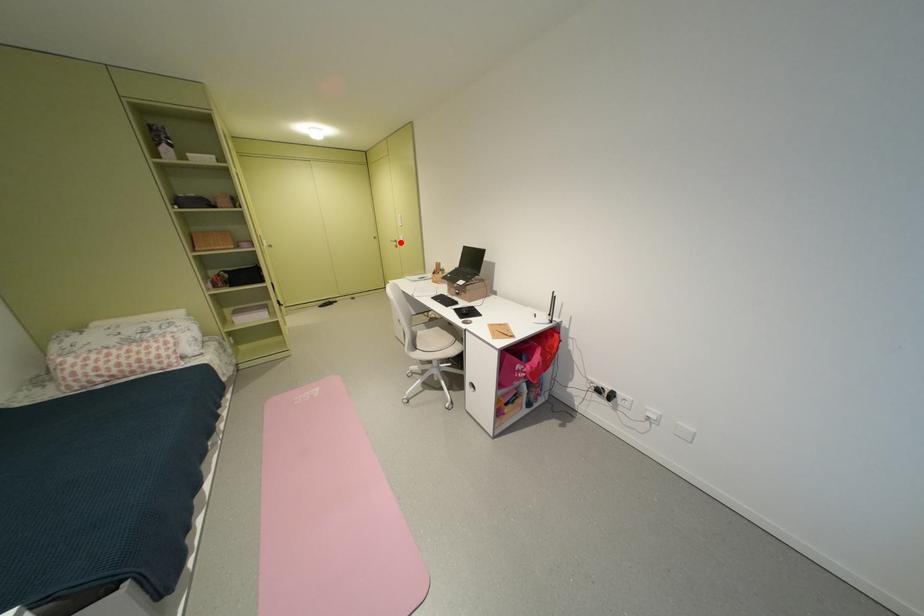
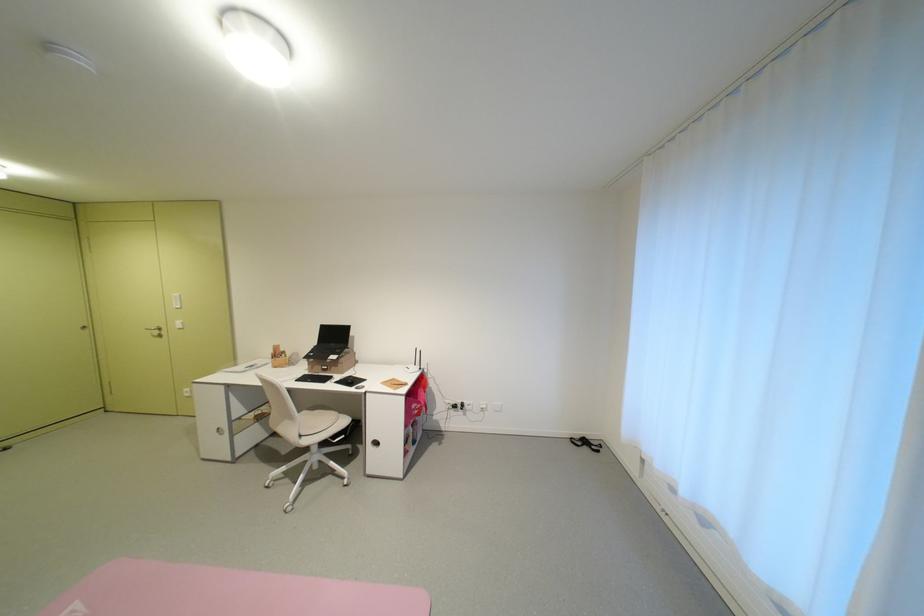
Locate, in the second image, the point that corresponds to the highlighted location in the first image.

(156, 331)